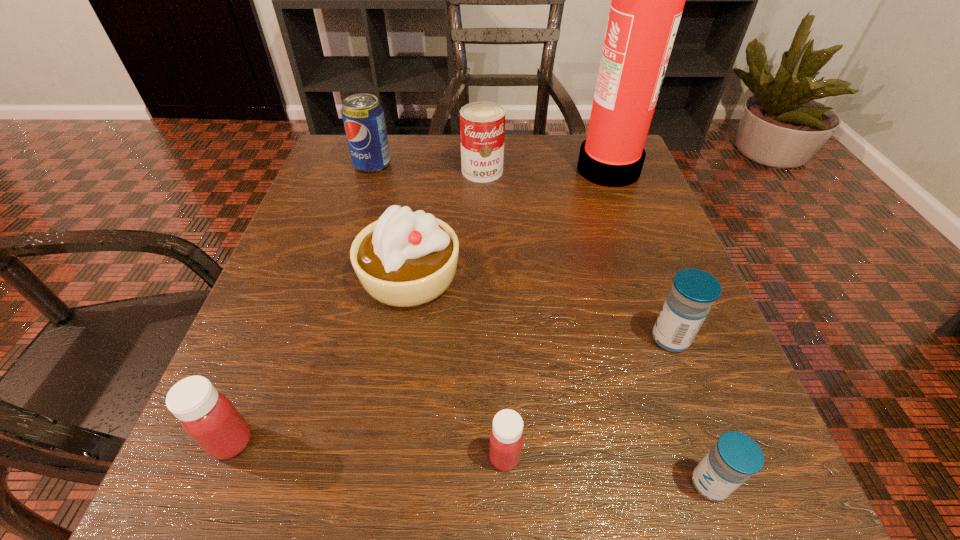
Identify the location of vacant space that's between the can and the nearer blue medicine. The width and height of the screenshot is (960, 540). (596, 327).

This screenshot has width=960, height=540. What are the coordinates of `vacant space that's between the whipped cream and the leftmost object` in the screenshot? It's located at (321, 360).

At what (x,y) coordinates should I click in order to perform the action: click on vacant area between the soda and the right red medicine. Please return your answer as a coordinate pair (x, y). The width and height of the screenshot is (960, 540). Looking at the image, I should click on (439, 311).

Locate an element on the screen. The height and width of the screenshot is (540, 960). vacant space that is in between the tallest object and the can is located at coordinates (545, 170).

Identify the location of vacant space that is in between the smaller blue medicine and the soda. The height and width of the screenshot is (540, 960). (541, 325).

I want to click on unoccupied position between the soda and the bigger red medicine, so click(x=302, y=303).

Image resolution: width=960 pixels, height=540 pixels. I want to click on free space between the leftmost object and the smaller red medicine, so click(x=369, y=449).

Where is `empty location between the tallest object and the farthest medicine`? Image resolution: width=960 pixels, height=540 pixels. empty location between the tallest object and the farthest medicine is located at coordinates tap(639, 253).

Identify the location of unoccupied position between the fifth nearest object and the leftmost medicine. (321, 360).

Select which object is the third closest to the farthest medicine. Please provide its 2D coordinates. Your answer should be formatted as a tuple, i.e. [(x, y)], where the tuple contains the x and y coordinates of a point satisfying the conditions above.

[(405, 258)]